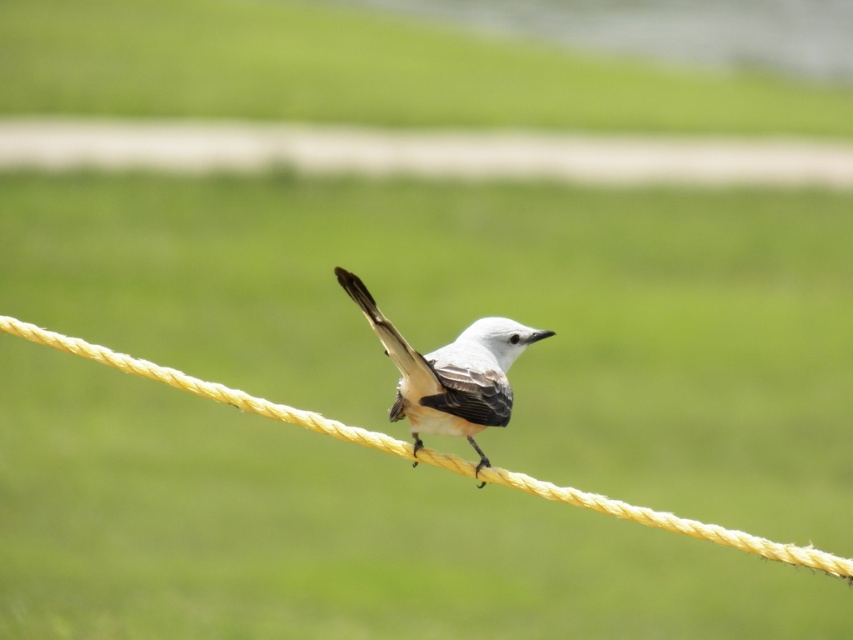
You are a photographer aiming to capture the white matte bird at center and the yellow rope at center in a single shot. Which object should you focus on first to ensure both are in sharp focus?

You should focus on the yellow rope at center first because the white matte bird at center is behind it, so focusing on the closer object will help both be in focus.

You are a photographer trying to capture the white matte bird at center and the yellow rope at center in a single shot. Based on their positions, which object should you focus on first to ensure both are in frame?

Answer: The yellow rope at center is to the left of the white matte bird at center, so you should focus on the white matte bird at center first to ensure both are in frame.

You are a photographer trying to capture the white matte bird at center and the yellow rope at center in a single frame. Given that your camera can focus on objects within a 10 inch range, will both subjects be in focus?

The yellow rope at center and white matte bird at center are 10.13 inches apart, which exceeds the camera focus range of 10 inches. Therefore, both subjects cannot be in focus simultaneously.